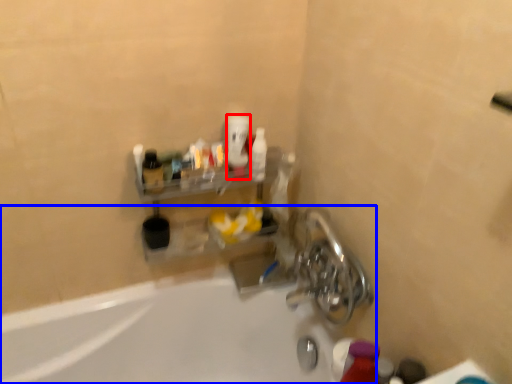
Question: Which object appears closest to the camera in this image, mouthwash (highlighted by a red box) or bathtub (highlighted by a blue box)?

Choices:
 (A) mouthwash
 (B) bathtub

Answer: (B)